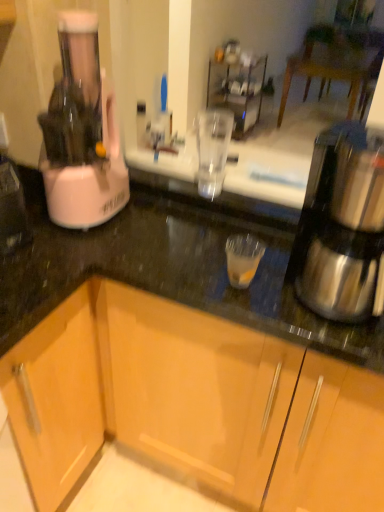
In order to face white plastic blender at left, should I rotate leftwards or rightwards?

It's best to rotate left around 14.872 degrees.

Find the location of a particular element. The height and width of the screenshot is (512, 384). white plastic blender at left is located at coordinates (82, 133).

The height and width of the screenshot is (512, 384). Identify the location of white plastic blender at left. (82, 133).

Who is taller, black granite countertop at center or wooden cabinet at lower center, the 2th cabinetry positioned from the left?

With more height is wooden cabinet at lower center, the 2th cabinetry positioned from the left.

Can you tell me how much black granite countertop at center and wooden cabinet at lower center, acting as the 1th cabinetry starting from the right, differ in facing direction?

They differ by 1.09 degrees in their facing directions.

Which point is more distant from viewer, [27,321] or [215,439]?

The point [215,439] is farther from the camera.

Which is nearer, [85,50] or [118,250]?

Point [85,50].

Can you confirm if white plastic blender at left is wider than black granite countertop at center?

In fact, white plastic blender at left might be narrower than black granite countertop at center.

Is white plastic blender at left positioned with its back to black granite countertop at center?

white plastic blender at left does not have its back to black granite countertop at center.

From the image's perspective, is shiny metallic coffee maker at right above black granite countertop at center?

No.

From a real-world perspective, is shiny metallic coffee maker at right on top of black granite countertop at center?

Yes, from a real-world perspective, shiny metallic coffee maker at right is over black granite countertop at center

Is shiny metallic coffee maker at right looking in the opposite direction of black granite countertop at center?

No, shiny metallic coffee maker at right is not facing the opposite direction of black granite countertop at center.

Can you confirm if wooden cabinet at lower center, acting as the 1th cabinetry starting from the right, is thinner than wooden cabinet at lower left, the first cabinetry in the left-to-right sequence?

In fact, wooden cabinet at lower center, acting as the 1th cabinetry starting from the right, might be wider than wooden cabinet at lower left, the first cabinetry in the left-to-right sequence.

Which is in front, point (182, 409) or point (5, 355)?

Positioned in front is point (5, 355).

From the image's perspective, is wooden cabinet at lower center, acting as the 1th cabinetry starting from the right, beneath wooden cabinet at lower left, which is the 2th cabinetry in right-to-left order?

No, from the image's perspective, wooden cabinet at lower center, acting as the 1th cabinetry starting from the right, is not below wooden cabinet at lower left, which is the 2th cabinetry in right-to-left order.

Are wooden cabinet at lower center, acting as the 1th cabinetry starting from the right, and wooden cabinet at lower left, which is the 2th cabinetry in right-to-left order, far apart?

Actually, wooden cabinet at lower center, acting as the 1th cabinetry starting from the right, and wooden cabinet at lower left, which is the 2th cabinetry in right-to-left order, are a little close together.

Is wooden cabinet at lower center, acting as the 1th cabinetry starting from the right, turned away from shiny metallic coffee maker at right?

No, wooden cabinet at lower center, acting as the 1th cabinetry starting from the right, is not facing away from shiny metallic coffee maker at right.

In the scene shown: From a real-world perspective, is wooden cabinet at lower center, the 2th cabinetry positioned from the left, located higher than shiny metallic coffee maker at right?

No, from a real-world perspective, wooden cabinet at lower center, the 2th cabinetry positioned from the left, is not above shiny metallic coffee maker at right.

From the image's perspective, which is below, wooden cabinet at lower center, the 2th cabinetry positioned from the left, or shiny metallic coffee maker at right?

wooden cabinet at lower center, the 2th cabinetry positioned from the left.

Which point is more forward, (124,323) or (363,141)?

The point (363,141) is in front.

You are a GUI agent. You are given a task and a screenshot of the screen. Output one action in this format:
    pyautogui.click(x=<x>, y=<y>)
    Task: Click on the home appliance above the wooden cabinet at lower center, the 2th cabinetry positioned from the left (from a real-world perspective)
    Image resolution: width=384 pixels, height=512 pixels.
    Given the screenshot: What is the action you would take?
    pyautogui.click(x=82, y=133)

Is wooden cabinet at lower center, the 2th cabinetry positioned from the left, facing towards white plastic blender at left?

No, wooden cabinet at lower center, the 2th cabinetry positioned from the left, is not facing towards white plastic blender at left.

Is wooden cabinet at lower center, the 2th cabinetry positioned from the left, at the right side of white plastic blender at left?

Indeed, wooden cabinet at lower center, the 2th cabinetry positioned from the left, is positioned on the right side of white plastic blender at left.

Which of these two, wooden cabinet at lower center, the 2th cabinetry positioned from the left, or white plastic blender at left, stands shorter?

Standing shorter between the two is white plastic blender at left.

Is shiny metallic coffee maker at right at the right side of white plastic blender at left?

Indeed, shiny metallic coffee maker at right is positioned on the right side of white plastic blender at left.

Identify the location of home appliance above the shiny metallic coffee maker at right (from a real-world perspective). (82, 133).

Looking at this image, from a real-world perspective, is shiny metallic coffee maker at right above or below white plastic blender at left?

Clearly, from a real-world perspective, shiny metallic coffee maker at right is below white plastic blender at left.

What's the angular difference between shiny metallic coffee maker at right and white plastic blender at left's facing directions?

shiny metallic coffee maker at right and white plastic blender at left are facing 0.000203 degrees away from each other.

Identify the location of the 1st cabinetry below the black granite countertop at center (from the image's perspective). The height and width of the screenshot is (512, 384). (193, 403).

Image resolution: width=384 pixels, height=512 pixels. Identify the location of countertop that is on the right side of white plastic blender at left. (169, 271).

Considering their positions, is wooden cabinet at lower center, acting as the 1th cabinetry starting from the right, positioned further to black granite countertop at center than wooden cabinet at lower left, which is the 2th cabinetry in right-to-left order?

The object further to black granite countertop at center is wooden cabinet at lower left, which is the 2th cabinetry in right-to-left order.

Based on their spatial positions, is wooden cabinet at lower center, the 2th cabinetry positioned from the left, or black granite countertop at center closer to shiny metallic coffee maker at right?

black granite countertop at center lies closer to shiny metallic coffee maker at right than the other object.

Which object lies nearer to the anchor point wooden cabinet at lower center, acting as the 1th cabinetry starting from the right, black granite countertop at center or white plastic blender at left?

black granite countertop at center.

Which object lies further to the anchor point black granite countertop at center, wooden cabinet at lower left, which is the 2th cabinetry in right-to-left order, or wooden cabinet at lower center, the 2th cabinetry positioned from the left?

wooden cabinet at lower left, which is the 2th cabinetry in right-to-left order, is further to black granite countertop at center.

From the image, which object appears to be nearer to white plastic blender at left, wooden cabinet at lower center, acting as the 1th cabinetry starting from the right, or wooden cabinet at lower left, the first cabinetry in the left-to-right sequence?

wooden cabinet at lower left, the first cabinetry in the left-to-right sequence, is closer to white plastic blender at left.

Considering their positions, is wooden cabinet at lower center, acting as the 1th cabinetry starting from the right, positioned further to white plastic blender at left than shiny metallic coffee maker at right?

Based on the image, shiny metallic coffee maker at right appears to be further to white plastic blender at left.

Looking at the image, which one is located further to wooden cabinet at lower left, which is the 2th cabinetry in right-to-left order, white plastic blender at left or wooden cabinet at lower center, acting as the 1th cabinetry starting from the right?

white plastic blender at left is further to wooden cabinet at lower left, which is the 2th cabinetry in right-to-left order.

Consider the image. When comparing their distances from wooden cabinet at lower left, which is the 2th cabinetry in right-to-left order, does black granite countertop at center or wooden cabinet at lower center, the 2th cabinetry positioned from the left, seem closer?

The object closer to wooden cabinet at lower left, which is the 2th cabinetry in right-to-left order, is wooden cabinet at lower center, the 2th cabinetry positioned from the left.

I want to click on countertop between wooden cabinet at lower left, which is the 2th cabinetry in right-to-left order, and wooden cabinet at lower center, acting as the 1th cabinetry starting from the right, so click(169, 271).

Find the location of a particular element. This screenshot has height=512, width=384. countertop situated between wooden cabinet at lower left, the first cabinetry in the left-to-right sequence, and shiny metallic coffee maker at right from left to right is located at coordinates (169, 271).

The image size is (384, 512). I want to click on countertop located between white plastic blender at left and shiny metallic coffee maker at right in the left-right direction, so coord(169,271).

In order to click on countertop between white plastic blender at left and wooden cabinet at lower left, which is the 2th cabinetry in right-to-left order, vertically in this screenshot , I will do 169,271.